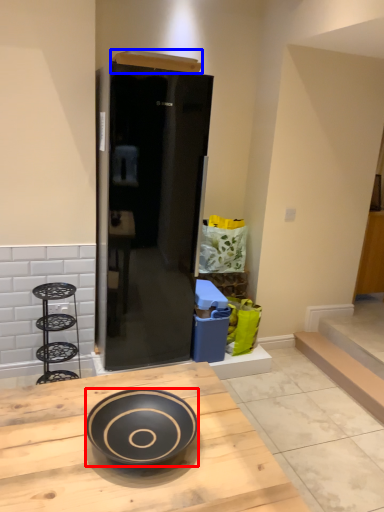
Question: Which object is further to the camera taking this photo, bowl (highlighted by a red box) or box (highlighted by a blue box)?

Choices:
 (A) bowl
 (B) box

Answer: (B)